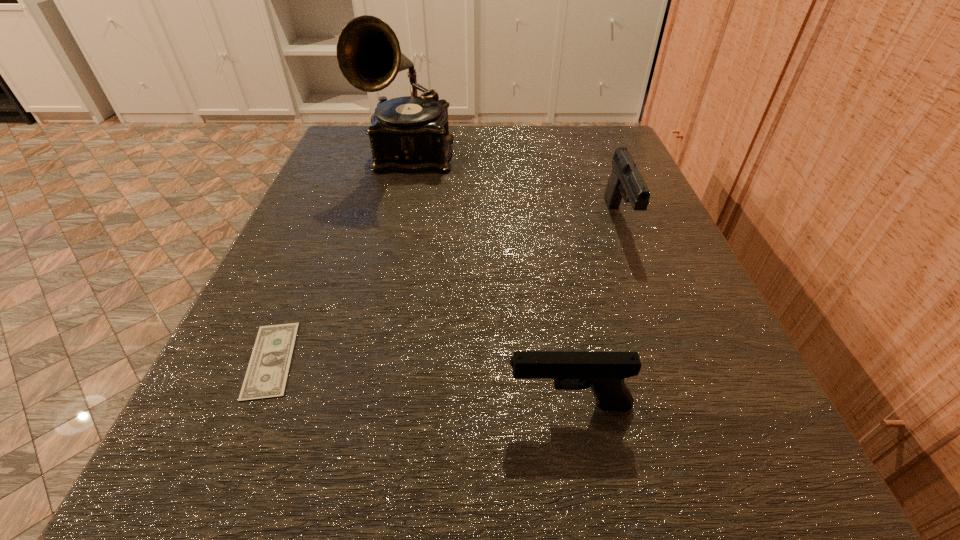
You are a GUI agent. You are given a task and a screenshot of the screen. Output one action in this format:
    pyautogui.click(x=<x>, y=<y>)
    Task: Click on the vacant area that lies between the phonograph record and the third object from left to right
    This screenshot has height=540, width=960.
    Given the screenshot: What is the action you would take?
    pyautogui.click(x=490, y=280)

The image size is (960, 540). In order to click on vacant region between the shortest object and the shorter pistol in this screenshot , I will do `click(420, 382)`.

Where is `free space between the third object from left to right and the rightmost object`? This screenshot has height=540, width=960. free space between the third object from left to right and the rightmost object is located at coordinates (594, 313).

Where is `free space between the phonograph record and the third nearest object`? This screenshot has height=540, width=960. free space between the phonograph record and the third nearest object is located at coordinates (515, 188).

Locate an element on the screen. The height and width of the screenshot is (540, 960). object that ranks as the second closest to the second object from right to left is located at coordinates (625, 180).

At what (x,y) coordinates should I click in order to perform the action: click on object that is the third nearest to the taller pistol. Please return your answer as a coordinate pair (x, y). This screenshot has height=540, width=960. Looking at the image, I should click on (266, 377).

Image resolution: width=960 pixels, height=540 pixels. In order to click on free space that satisfies the following two spatial constraints: 1. aim along the barrel of the taller pistol; 2. on the front-facing side of the shorter pistol in this screenshot , I will do `click(691, 405)`.

I want to click on free space that satisfies the following two spatial constraints: 1. aim along the barrel of the second farthest object; 2. on the front-facing side of the nearer pistol, so click(x=691, y=405).

Find the location of a particular element. This screenshot has height=540, width=960. vacant region that satisfies the following two spatial constraints: 1. aim along the barrel of the right pistol; 2. on the front-facing side of the third tallest object is located at coordinates (691, 405).

Find the location of a particular element. The width and height of the screenshot is (960, 540). free spot that satisfies the following two spatial constraints: 1. aim along the barrel of the farther pistol; 2. on the front-facing side of the second shortest object is located at coordinates (691, 405).